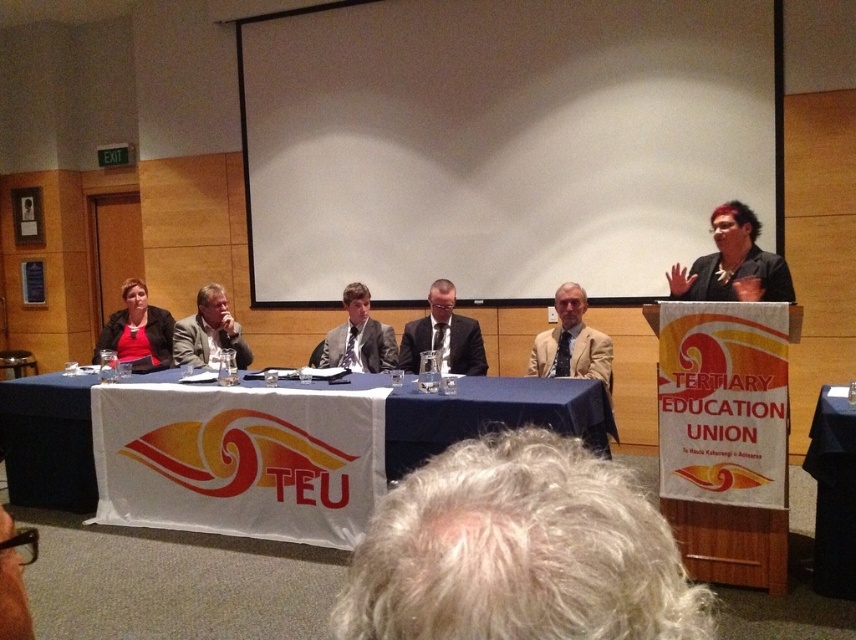
Can you confirm if white matte projection screen at upper center is shorter than black fabric at upper right?

No, white matte projection screen at upper center is not shorter than black fabric at upper right.

Is white matte projection screen at upper center below black fabric at upper right?

Incorrect, white matte projection screen at upper center is not positioned below black fabric at upper right.

This screenshot has height=640, width=856. Find the location of `white matte projection screen at upper center`. white matte projection screen at upper center is located at coordinates (498, 144).

Measure the distance between point (557, 312) and camera.

Point (557, 312) and camera are 14.71 feet apart from each other.

Between tan fabric suit at center and matte gray suit at center, which one appears on the left side from the viewer's perspective?

Positioned to the left is matte gray suit at center.

Is point (581, 300) positioned in front of point (349, 292)?

Yes.

The height and width of the screenshot is (640, 856). I want to click on tan fabric suit at center, so click(571, 342).

Is black fabric at upper right shorter than matte gray suit at center?

Indeed, black fabric at upper right has a lesser height compared to matte gray suit at center.

Between black fabric at upper right and matte gray suit at center, which one appears on the right side from the viewer's perspective?

black fabric at upper right

At what (x,y) coordinates should I click in order to perform the action: click on black fabric at upper right. Please return your answer as a coordinate pair (x, y). This screenshot has height=640, width=856. Looking at the image, I should click on (733, 262).